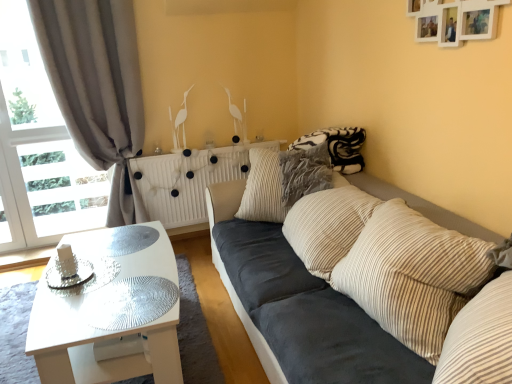
Image resolution: width=512 pixels, height=384 pixels. I want to click on vacant space underneath transparent glass table at lower left (from a real-world perspective), so click(x=125, y=301).